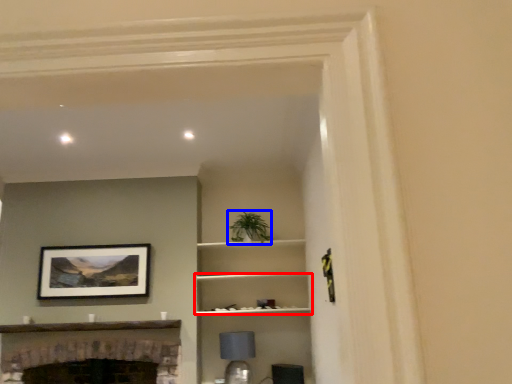
Question: Which point is further to the camera, shelf (highlighted by a red box) or plant (highlighted by a blue box)?

Choices:
 (A) shelf
 (B) plant

Answer: (B)